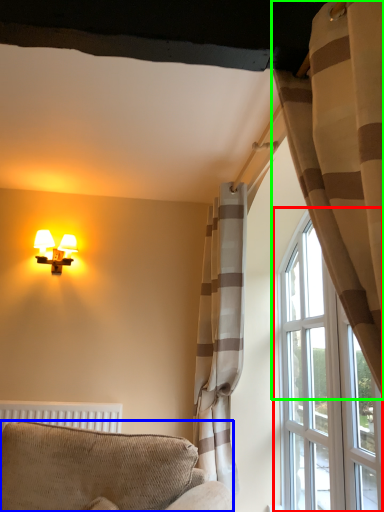
Question: Which object is the farthest from window (highlighted by a red box)? Choose among these: furniture (highlighted by a blue box) or curtain (highlighted by a green box).

Choices:
 (A) furniture
 (B) curtain

Answer: (B)